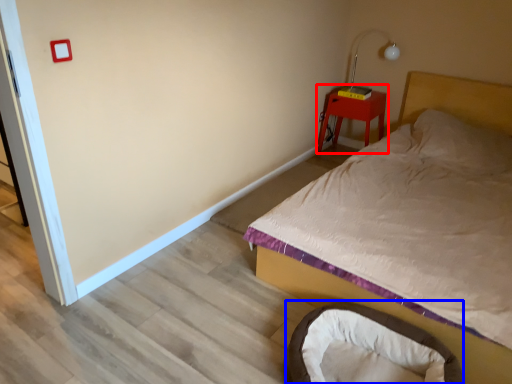
Question: Which object appears farthest to the camera in this image, nightstand (highlighted by a red box) or infant bed (highlighted by a blue box)?

Choices:
 (A) nightstand
 (B) infant bed

Answer: (A)